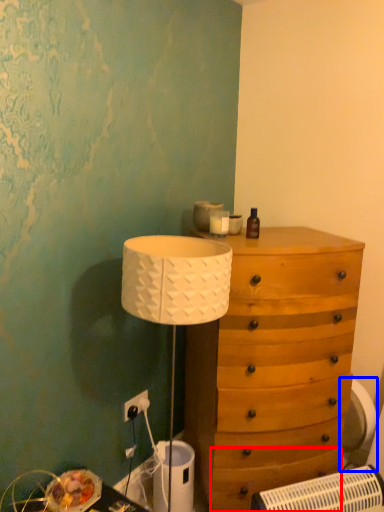
Question: Which object is closer to the camera taking this photo, drawer (highlighted by a red box) or swivel chair (highlighted by a blue box)?

Choices:
 (A) drawer
 (B) swivel chair

Answer: (A)